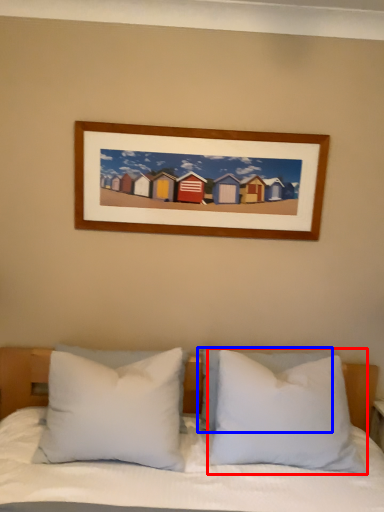
Question: Which point is further to the camera, pillow (highlighted by a red box) or pillow (highlighted by a blue box)?

Choices:
 (A) pillow
 (B) pillow

Answer: (B)